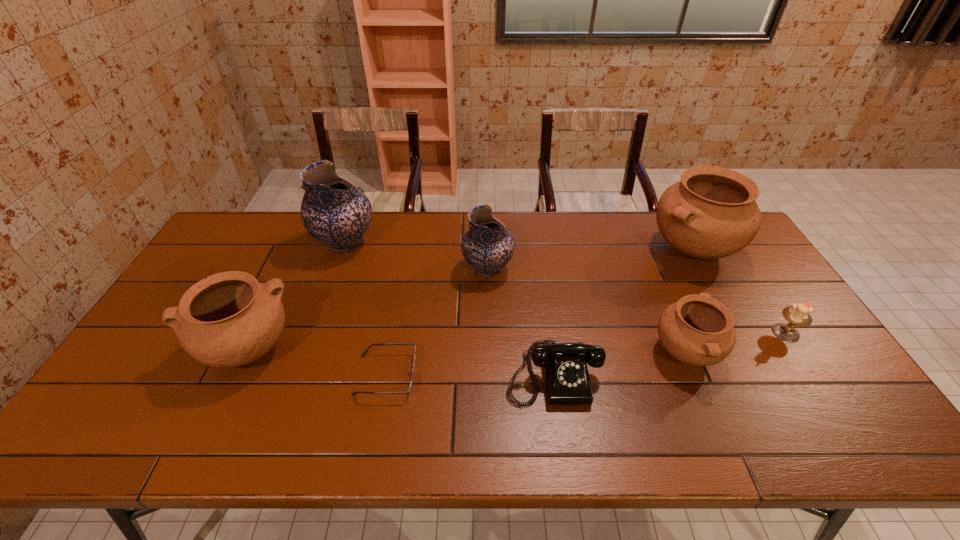
Where is `unoccupied position between the left blue pottery and the shortest object`? This screenshot has width=960, height=540. unoccupied position between the left blue pottery and the shortest object is located at coordinates (366, 309).

Identify the location of vacant space in between the leftmost terracotta pottery and the spectacles. Image resolution: width=960 pixels, height=540 pixels. (316, 362).

Where is `vacant area between the bigger blue pottery and the farthest terracotta pottery`? This screenshot has width=960, height=540. vacant area between the bigger blue pottery and the farthest terracotta pottery is located at coordinates (518, 246).

Where is `free spot between the leftmost terracotta pottery and the spectacles`? The height and width of the screenshot is (540, 960). free spot between the leftmost terracotta pottery and the spectacles is located at coordinates (316, 362).

I want to click on free point between the candle holder and the smallest terracotta pottery, so point(736,343).

In order to click on free spot between the shortest object and the telephone in this screenshot , I will do `click(469, 374)`.

Image resolution: width=960 pixels, height=540 pixels. Identify the location of vacant region between the third pottery from right to left and the second smallest terracotta pottery. (367, 309).

The image size is (960, 540). I want to click on object that stands as the third closest to the black telephone, so click(x=363, y=355).

The width and height of the screenshot is (960, 540). What are the coordinates of `object that is the fourth closest to the second biggest terracotta pottery` in the screenshot? It's located at (567, 381).

Choose which pottery is the second nearest neighbor to the smallest terracotta pottery. Please provide its 2D coordinates. Your answer should be formatted as a tuple, i.e. [(x, y)], where the tuple contains the x and y coordinates of a point satisfying the conditions above.

[(488, 245)]